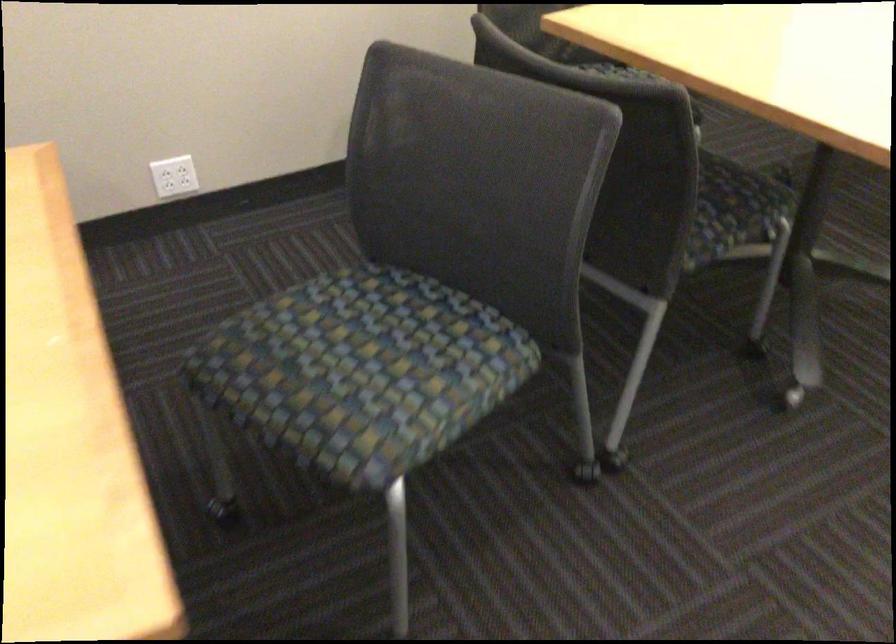
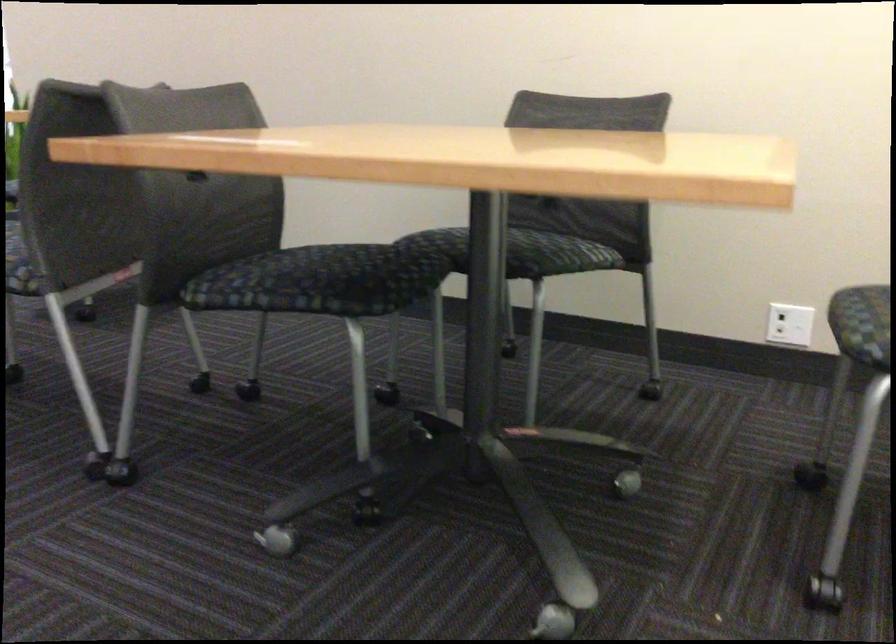
Find the pixel in the second image that matches the point at 755,192 in the first image.

(320, 281)